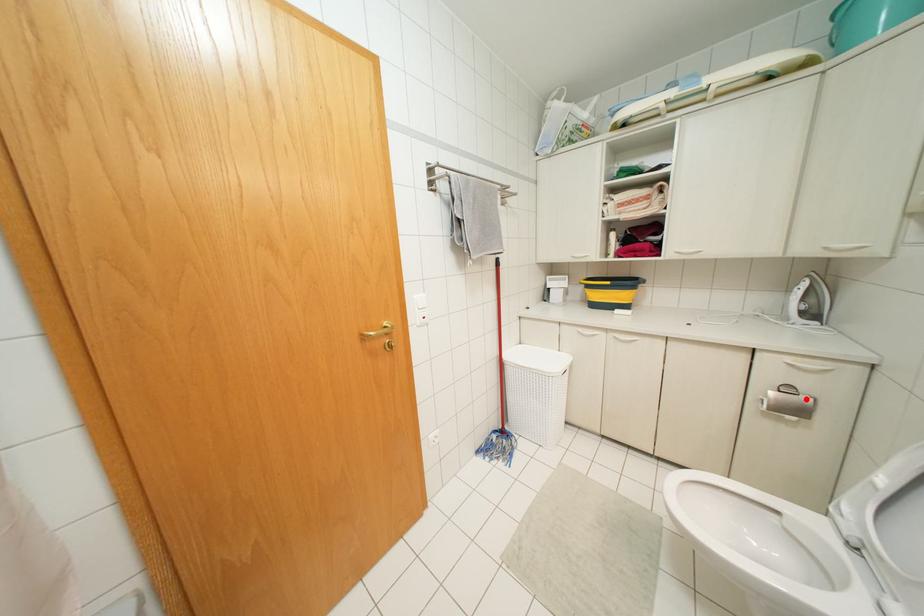
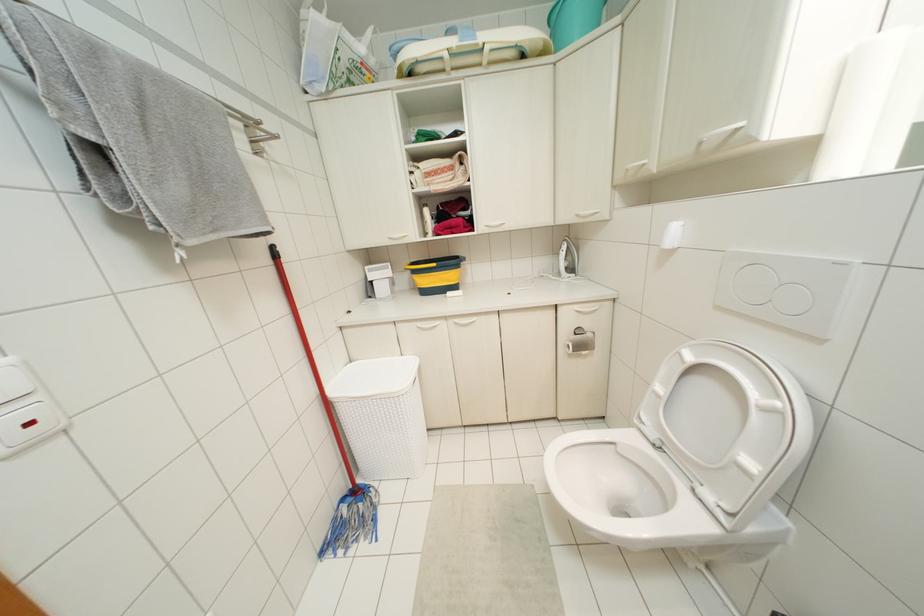
Where in the second image is the point corresponding to the highlighted location from the first image?

(589, 334)